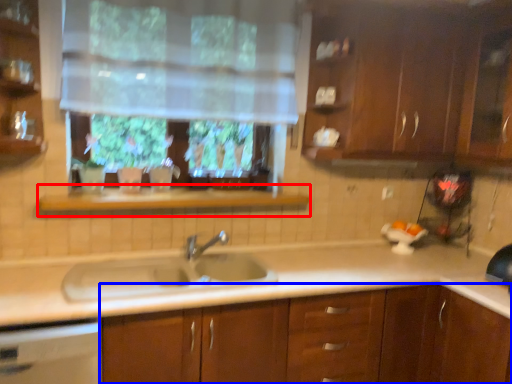
Question: Which object appears closest to the camera in this image, window sill (highlighted by a red box) or cabinetry (highlighted by a blue box)?

Choices:
 (A) window sill
 (B) cabinetry

Answer: (B)